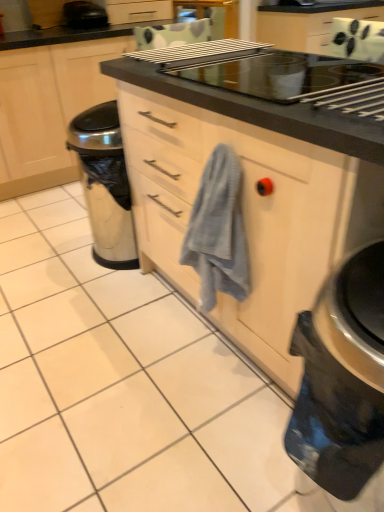
Question: Considering the relative positions of black plastic toaster at upper left and matte black cabinet at center in the image provided, is black plastic toaster at upper left behind matte black cabinet at center?

Choices:
 (A) no
 (B) yes

Answer: (B)

Question: Considering the relative sizes of black plastic toaster at upper left and matte black cabinet at center in the image provided, is black plastic toaster at upper left thinner than matte black cabinet at center?

Choices:
 (A) no
 (B) yes

Answer: (B)

Question: Is black plastic toaster at upper left completely or partially outside of matte black cabinet at center?

Choices:
 (A) yes
 (B) no

Answer: (A)

Question: Are black plastic toaster at upper left and matte black cabinet at center far apart?

Choices:
 (A) yes
 (B) no

Answer: (B)

Question: Would you say black plastic toaster at upper left contains matte black cabinet at center?

Choices:
 (A) yes
 (B) no

Answer: (B)

Question: Is black plastic toaster at upper left facing towards matte black cabinet at center?

Choices:
 (A) no
 (B) yes

Answer: (A)

Question: Can you see gray textured towel at center touching matte black cabinet at center?

Choices:
 (A) no
 (B) yes

Answer: (A)

Question: Can you confirm if gray textured towel at center is taller than matte black cabinet at center?

Choices:
 (A) no
 (B) yes

Answer: (A)

Question: Considering the relative sizes of gray textured towel at center and matte black cabinet at center in the image provided, is gray textured towel at center shorter than matte black cabinet at center?

Choices:
 (A) yes
 (B) no

Answer: (A)

Question: Does gray textured towel at center appear on the right side of matte black cabinet at center?

Choices:
 (A) no
 (B) yes

Answer: (B)

Question: Is gray textured towel at center facing away from matte black cabinet at center?

Choices:
 (A) no
 (B) yes

Answer: (A)

Question: From a real-world perspective, is gray textured towel at center below matte black cabinet at center?

Choices:
 (A) no
 (B) yes

Answer: (A)

Question: Is the position of gray textured towel at center more distant than that of black glossy electric kettle at lower right?

Choices:
 (A) no
 (B) yes

Answer: (B)